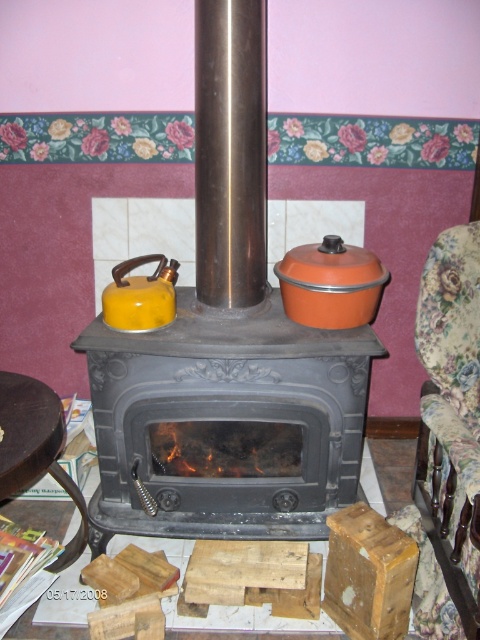
In the scene shown: Does matte black stove at center appear on the left side of yellow matte tea pot at center?

In fact, matte black stove at center is to the right of yellow matte tea pot at center.

Can you confirm if matte black stove at center is taller than yellow matte tea pot at center?

Yes.

Between point (159, 356) and point (171, 289), which one is positioned in front?

Point (159, 356) is more forward.

Locate an element on the screen. matte black stove at center is located at coordinates pos(226,422).

Does floral fabric armchair at right have a greater width compared to yellow matte tea pot at center?

No.

Who is more distant from viewer, (463, 576) or (146, 285)?

The point (146, 285) is behind.

I want to click on floral fabric armchair at right, so click(447, 433).

Locate an element on the screen. Image resolution: width=480 pixels, height=640 pixels. floral fabric armchair at right is located at coordinates (447, 433).

Identify the location of matte black fireplace at center. Image resolution: width=480 pixels, height=640 pixels. (227, 352).

Is matte black fireplace at center positioned behind yellow matte tea pot at center?

That is False.

This screenshot has height=640, width=480. Describe the element at coordinates (227, 352) in the screenshot. I see `matte black fireplace at center` at that location.

Locate an element on the screen. This screenshot has height=640, width=480. matte black fireplace at center is located at coordinates click(227, 352).